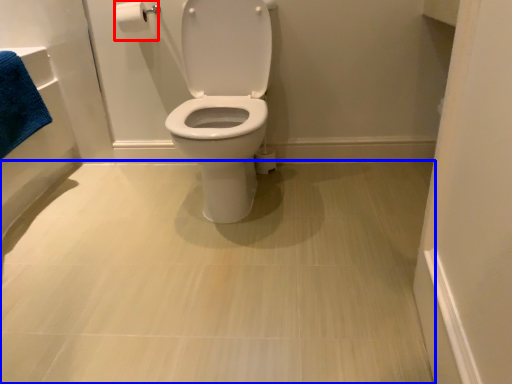
Question: Which point is closer to the camera, toilet paper (highlighted by a red box) or plain (highlighted by a blue box)?

Choices:
 (A) toilet paper
 (B) plain

Answer: (B)